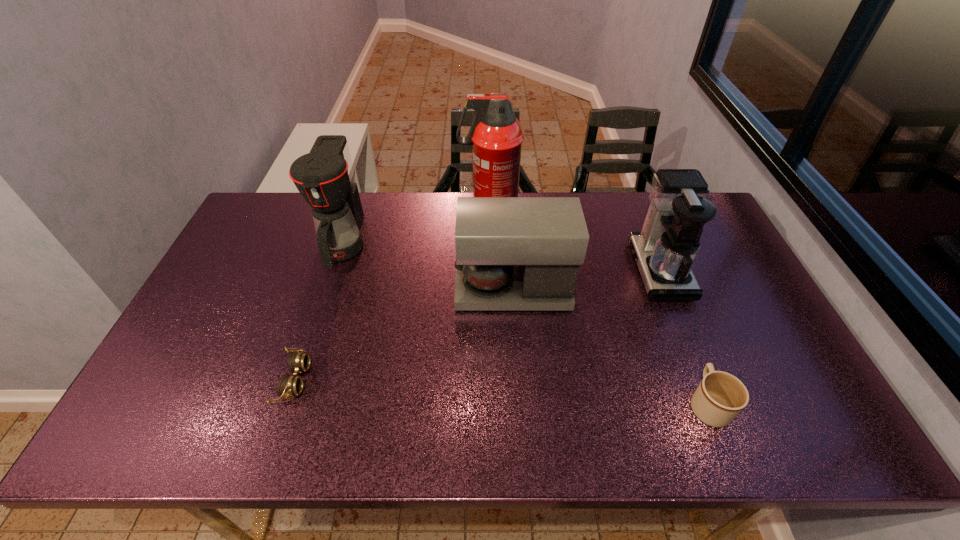
This screenshot has height=540, width=960. Find the location of `fire extinguisher`. fire extinguisher is located at coordinates (496, 135).

Where is `the leftmost coffee maker`? the leftmost coffee maker is located at coordinates (325, 178).

This screenshot has width=960, height=540. I want to click on the rightmost coffee maker, so click(x=666, y=249).

I want to click on the second coffee maker from left to right, so click(512, 253).

Where is `the fifth tallest object`? Image resolution: width=960 pixels, height=540 pixels. the fifth tallest object is located at coordinates (720, 397).

Where is `the shortest object`? This screenshot has width=960, height=540. the shortest object is located at coordinates (289, 386).

Locate an element on the screen. vacant space positioned 0.080m on the trigger side of the fire extinguisher is located at coordinates (437, 210).

Where is `free space located 0.160m on the trigger side of the fire extinguisher`? This screenshot has height=540, width=960. free space located 0.160m on the trigger side of the fire extinguisher is located at coordinates (415, 210).

At what (x,y) coordinates should I click in order to perform the action: click on vacant space positioned 0.240m on the trigger side of the fire extinguisher. Please return your answer as a coordinate pair (x, y). The height and width of the screenshot is (540, 960). Looking at the image, I should click on (392, 210).

This screenshot has width=960, height=540. Find the location of `vacant region located pour from the carafe of the leftmost coffee maker`. vacant region located pour from the carafe of the leftmost coffee maker is located at coordinates (323, 306).